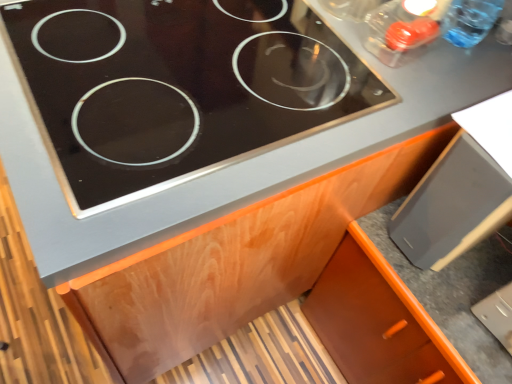
What do you see at coordinates (174, 88) in the screenshot?
I see `black glass cooktop at upper center` at bounding box center [174, 88].

In order to face orange wood cabinet at lower right, should I rotate leftwards or rightwards?

You should look right and rotate roughly 25.549 degrees.

Locate an element on the screen. The image size is (512, 384). black glass cooktop at upper center is located at coordinates (174, 88).

From the image's perspective, is orange wood cabinet at lower right on matte black drawer at lower right?

No.

What's the angular difference between orange wood cabinet at lower right and matte black drawer at lower right's facing directions?

The angular difference between orange wood cabinet at lower right and matte black drawer at lower right is 0.61 degrees.

Is orange wood cabinet at lower right touching matte black drawer at lower right?

No, orange wood cabinet at lower right is not with matte black drawer at lower right.

Does orange wood cabinet at lower right come in front of matte black drawer at lower right?

No, orange wood cabinet at lower right is further to the viewer.

Based on the photo, is matte black drawer at lower right positioned in front of orange wood cabinet at lower right?

Yes, matte black drawer at lower right is closer to the camera.

Is matte black drawer at lower right directly adjacent to orange wood cabinet at lower right?

No, matte black drawer at lower right is not next to orange wood cabinet at lower right.

What's the angular difference between matte black drawer at lower right and orange wood cabinet at lower right's facing directions?

The facing directions of matte black drawer at lower right and orange wood cabinet at lower right are 0.61 degrees apart.

Considering the sizes of objects matte black drawer at lower right and orange wood cabinet at lower right in the image provided, who is thinner, matte black drawer at lower right or orange wood cabinet at lower right?

With smaller width is matte black drawer at lower right.

Which of these two, black glass cooktop at upper center or transparent plastic bottle at upper right, is wider?

black glass cooktop at upper center.

Based on the photo, is black glass cooktop at upper center looking in the opposite direction of transparent plastic bottle at upper right?

black glass cooktop at upper center does not have its back to transparent plastic bottle at upper right.

Would you say transparent plastic bottle at upper right is part of black glass cooktop at upper center's contents?

No, transparent plastic bottle at upper right is not a part of black glass cooktop at upper center.

Could you measure the distance between black glass cooktop at upper center and transparent plastic bottle at upper right?

black glass cooktop at upper center is 22.57 inches from transparent plastic bottle at upper right.

Based on their positions, is transparent plastic bottle at upper right located to the left or right of black glass cooktop at upper center?

In the image, transparent plastic bottle at upper right appears on the right side of black glass cooktop at upper center.

Which is in front, transparent plastic bottle at upper right or black glass cooktop at upper center?

black glass cooktop at upper center is in front.

Is transparent plastic bottle at upper right taller or shorter than black glass cooktop at upper center?

Clearly, transparent plastic bottle at upper right is taller compared to black glass cooktop at upper center.

Is transparent plastic bottle at upper right looking in the opposite direction of black glass cooktop at upper center?

No, black glass cooktop at upper center is not at the back of transparent plastic bottle at upper right.

From the image's perspective, which one is positioned lower, transparent plastic bottle at upper right or matte black drawer at lower right?

matte black drawer at lower right, from the image's perspective.

How distant is transparent plastic bottle at upper right from matte black drawer at lower right?

transparent plastic bottle at upper right and matte black drawer at lower right are 15.88 inches apart.

Which of these two, transparent plastic bottle at upper right or matte black drawer at lower right, is smaller?

transparent plastic bottle at upper right is smaller.

From a real-world perspective, is transparent plastic bottle at upper right above or below matte black drawer at lower right?

In terms of real-world spatial position, transparent plastic bottle at upper right is above matte black drawer at lower right.

Which of these two, orange wood cabinet at lower right or transparent plastic bottle at upper right, stands taller?

orange wood cabinet at lower right is taller.

Can you confirm if orange wood cabinet at lower right is bigger than transparent plastic bottle at upper right?

Yes, orange wood cabinet at lower right is bigger than transparent plastic bottle at upper right.

Could you tell me if orange wood cabinet at lower right is facing transparent plastic bottle at upper right?

No, orange wood cabinet at lower right is not oriented towards transparent plastic bottle at upper right.

From the image's perspective, is orange wood cabinet at lower right under transparent plastic bottle at upper right?

Yes, from the image's perspective, orange wood cabinet at lower right is below transparent plastic bottle at upper right.

Is orange wood cabinet at lower right wider or thinner than black glass cooktop at upper center?

In the image, orange wood cabinet at lower right appears to be wider than black glass cooktop at upper center.

From a real-world perspective, is orange wood cabinet at lower right beneath black glass cooktop at upper center?

Indeed, from a real-world perspective, orange wood cabinet at lower right is positioned beneath black glass cooktop at upper center.

Which is more to the right, orange wood cabinet at lower right or black glass cooktop at upper center?

From the viewer's perspective, orange wood cabinet at lower right appears more on the right side.

Locate an element on the screen. This screenshot has height=384, width=512. appliance that is above the orange wood cabinet at lower right (from a real-world perspective) is located at coordinates (452, 205).

Locate an element on the screen. This screenshot has height=384, width=512. cabinetry below the matte black drawer at lower right (from the image's perspective) is located at coordinates (377, 321).

In the scene shown: Which object lies further to the anchor point transparent plastic bottle at upper right, matte black drawer at lower right or orange wood cabinet at lower right?

orange wood cabinet at lower right is further to transparent plastic bottle at upper right.

Which object lies further to the anchor point transparent plastic bottle at upper right, orange wood cabinet at lower right or black glass cooktop at upper center?

orange wood cabinet at lower right lies further to transparent plastic bottle at upper right than the other object.

Based on the photo, which object lies nearer to the anchor point orange wood cabinet at lower right, transparent plastic bottle at upper right or black glass cooktop at upper center?

black glass cooktop at upper center is positioned closer to the anchor orange wood cabinet at lower right.

Estimate the real-world distances between objects in this image. Which object is further from black glass cooktop at upper center, orange wood cabinet at lower right or transparent plastic bottle at upper right?

transparent plastic bottle at upper right.

Which object lies further to the anchor point black glass cooktop at upper center, transparent plastic bottle at upper right or orange wood cabinet at lower right?

transparent plastic bottle at upper right lies further to black glass cooktop at upper center than the other object.

From the image, which object appears to be farther from transparent plastic bottle at upper right, black glass cooktop at upper center or matte black drawer at lower right?

Based on the image, black glass cooktop at upper center appears to be further to transparent plastic bottle at upper right.

Considering their positions, is transparent plastic bottle at upper right positioned closer to matte black drawer at lower right than orange wood cabinet at lower right?

orange wood cabinet at lower right is closer to matte black drawer at lower right.

In the scene shown: When comparing their distances from black glass cooktop at upper center, does matte black drawer at lower right or orange wood cabinet at lower right seem closer?

matte black drawer at lower right is positioned closer to the anchor black glass cooktop at upper center.

Identify the location of gas stove between transparent plastic bottle at upper right and orange wood cabinet at lower right in the up-down direction. (174, 88).

This screenshot has width=512, height=384. In order to click on appliance between black glass cooktop at upper center and transparent plastic bottle at upper right from left to right in this screenshot , I will do click(452, 205).

Locate an element on the screen. The image size is (512, 384). appliance between black glass cooktop at upper center and orange wood cabinet at lower right is located at coordinates (452, 205).

Find the location of a particular element. The height and width of the screenshot is (384, 512). appliance between transparent plastic bottle at upper right and orange wood cabinet at lower right in the vertical direction is located at coordinates (452, 205).